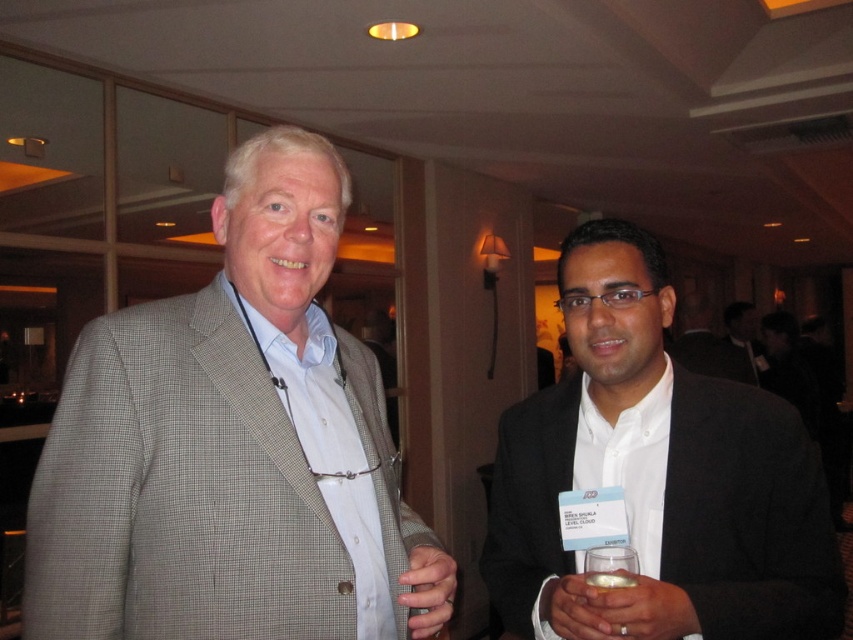
Question: Is clear plastic glass at lower center above matte gray suit at center?

Choices:
 (A) no
 (B) yes

Answer: (B)

Question: Among these objects, which one is nearest to the camera?

Choices:
 (A) clear glass at lower right
 (B) clear plastic glass at lower center
 (C) gray checkered suit at left

Answer: (C)

Question: Among these objects, which one is farthest from the camera?

Choices:
 (A) matte gray suit at center
 (B) white glossy shirt at center
 (C) clear plastic glass at lower center
 (D) clear glass at lower right

Answer: (B)

Question: Can you confirm if gray checkered suit at left is smaller than white shirt at center?

Choices:
 (A) yes
 (B) no

Answer: (A)

Question: Which object appears closest to the camera in this image?

Choices:
 (A) matte gray suit at center
 (B) translucent glass at lower right

Answer: (B)

Question: Does translucent glass at lower right have a greater width compared to white shirt at center?

Choices:
 (A) yes
 (B) no

Answer: (B)